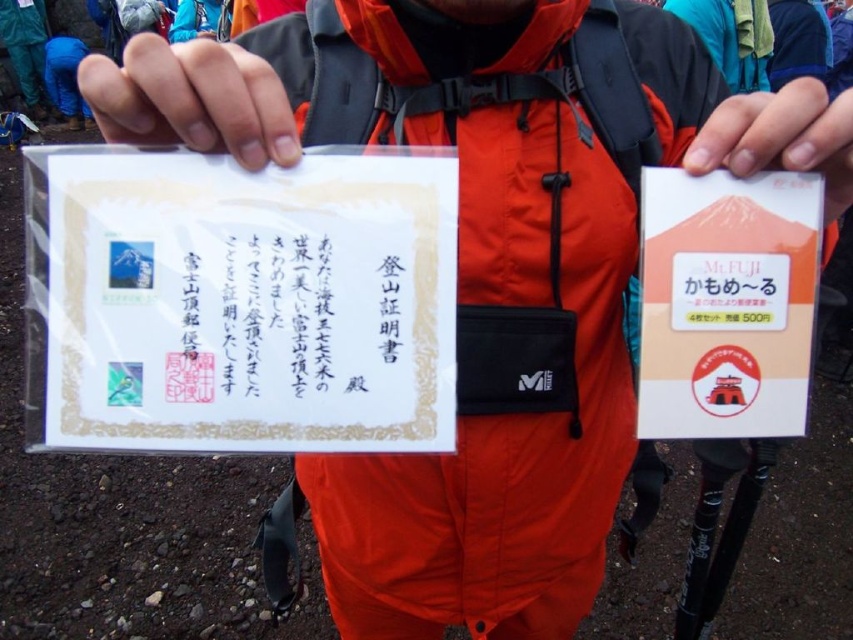
You are a hiker who just reached the summit. You have two documents in front of you, the white paper at center and the matte white paper at upper center. Which document is positioned to the right of the other?

The white paper at center is to the right of the matte white paper at upper center.

You are standing 18.48 inches away from the point at coordinates point (258, 342). If you want to take a photo of this point with a camera that has a focal length of 50mm, what is the minimum distance you need to move back to ensure the entire certificate in your left hand is visible in the frame?

The point at coordinates point (258, 342) is 18.48 inches away from you. To ensure the entire certificate in your left hand is visible, you need to move back until the distance is at least 24 inches.

You are a hiker who just reached the summit. You have two items in your hands, a matte white paper at upper center and a matte plastic card at center. Which item is closer to your face?

The matte white paper at upper center is closer to the viewer than the matte plastic card at center, so the matte white paper at upper center is closer to your face.